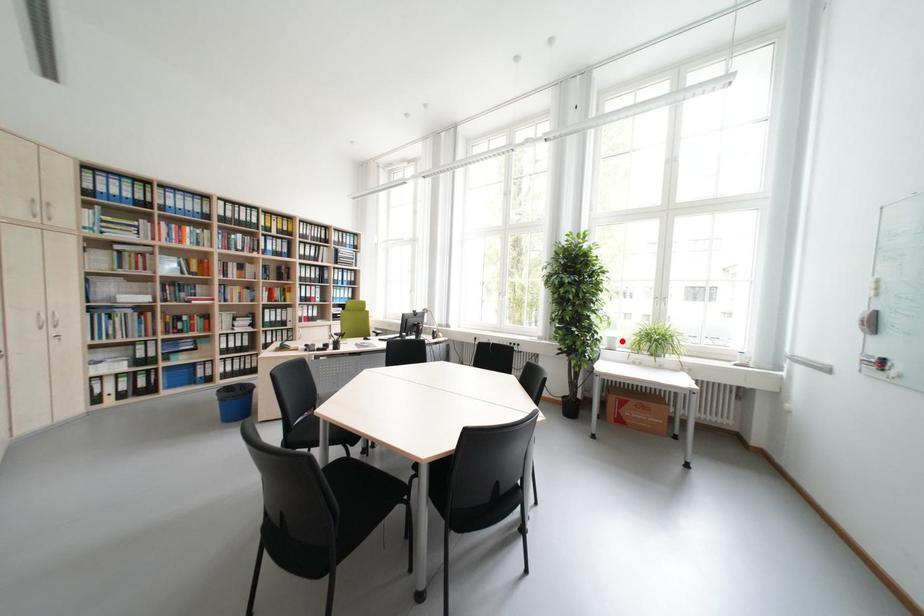
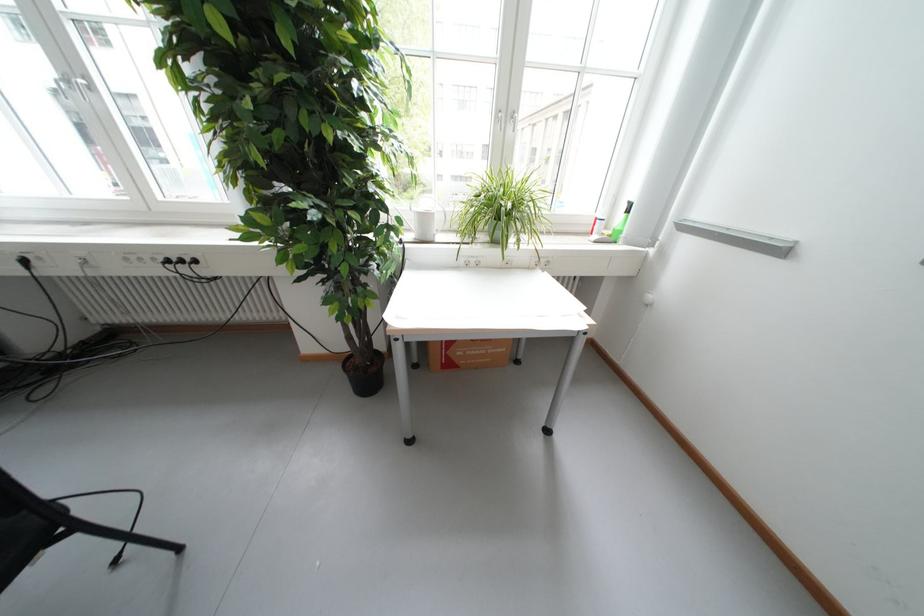
In the second image, find the point that corresponds to the highlighted location in the first image.

(435, 220)